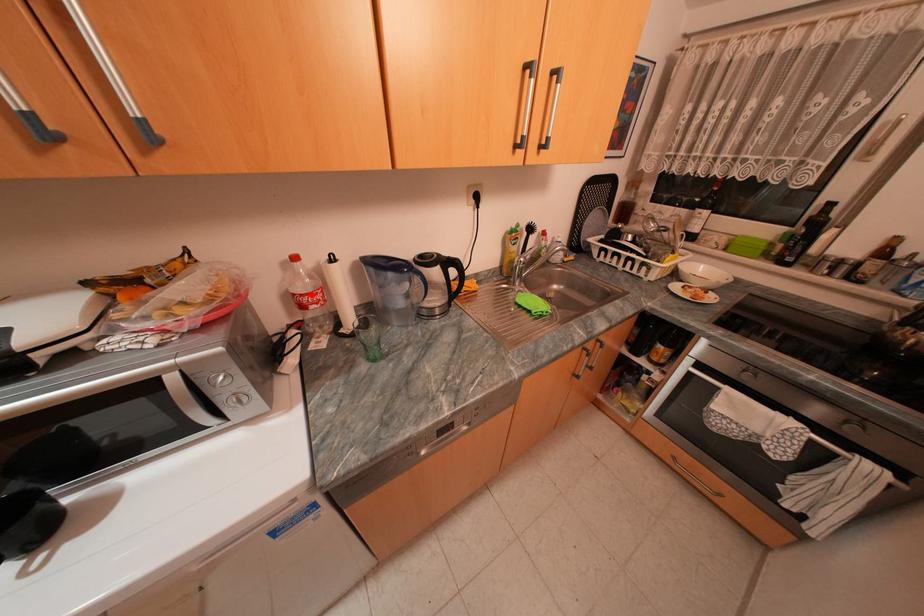
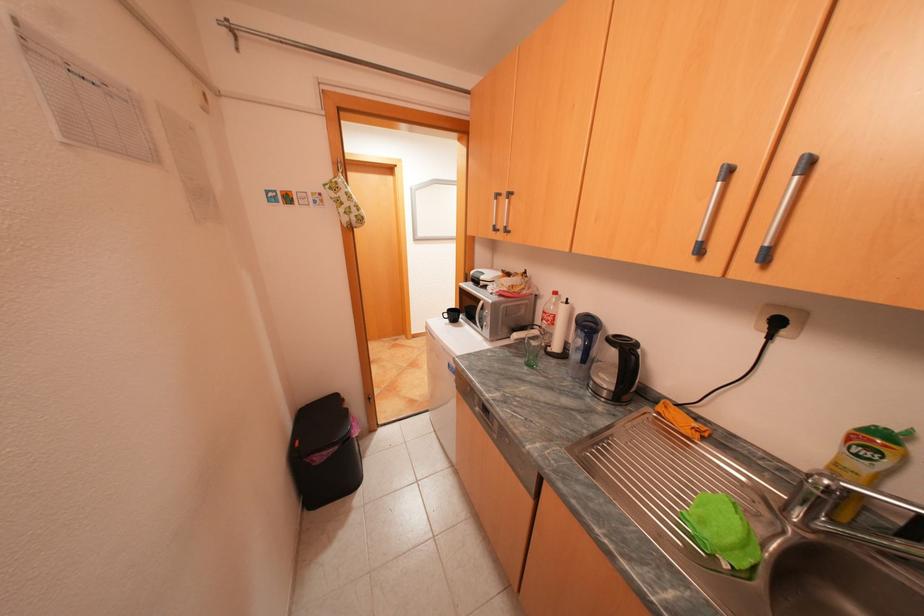
Where in the second image is the point corresponding to the highlighted location from the first image?

(553, 312)